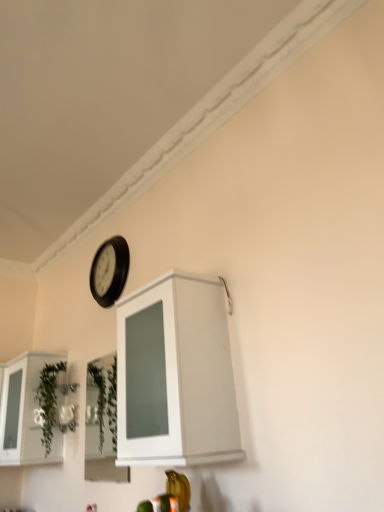
Question: Does black plastic clock at upper center turn towards white glossy cabinet at upper center, which is counted as the 1th cabinetry, starting from the right?

Choices:
 (A) no
 (B) yes

Answer: (A)

Question: Is black plastic clock at upper center surrounding white glossy cabinet at upper center, acting as the first cabinetry starting from the front?

Choices:
 (A) no
 (B) yes

Answer: (A)

Question: Can you confirm if black plastic clock at upper center is positioned to the left of white glossy cabinet at upper center, which is counted as the 1th cabinetry, starting from the right?

Choices:
 (A) no
 (B) yes

Answer: (B)

Question: From a real-world perspective, is black plastic clock at upper center beneath white glossy cabinet at upper center, acting as the first cabinetry starting from the front?

Choices:
 (A) yes
 (B) no

Answer: (B)

Question: From the image's perspective, is black plastic clock at upper center located above white glossy cabinet at upper center, the second cabinetry in the left-to-right sequence?

Choices:
 (A) no
 (B) yes

Answer: (B)

Question: Would you say white glossy cabinet at left, the first cabinetry viewed from the back, is to the left or to the right of white glossy cabinet at upper center, the second cabinetry in the left-to-right sequence, in the picture?

Choices:
 (A) right
 (B) left

Answer: (B)

Question: Is white glossy cabinet at left, which appears as the second cabinetry when viewed from the front, in front of or behind white glossy cabinet at upper center, acting as the first cabinetry starting from the front, in the image?

Choices:
 (A) front
 (B) behind

Answer: (B)

Question: Is white glossy cabinet at left, the 2th cabinetry viewed from the right, wider or thinner than white glossy cabinet at upper center, the second cabinetry in the left-to-right sequence?

Choices:
 (A) wide
 (B) thin

Answer: (A)

Question: In terms of height, does white glossy cabinet at left, the 2th cabinetry viewed from the right, look taller or shorter compared to white glossy cabinet at upper center, which is counted as the 1th cabinetry, starting from the right?

Choices:
 (A) tall
 (B) short

Answer: (B)

Question: From the image's perspective, relative to white glossy cabinet at upper center, the second cabinetry in the left-to-right sequence, is black plastic clock at upper center above or below?

Choices:
 (A) below
 (B) above

Answer: (B)

Question: Does point (119, 240) appear closer or farther from the camera than point (117, 386)?

Choices:
 (A) farther
 (B) closer

Answer: (A)

Question: Relative to white glossy cabinet at upper center, which is counted as the 1th cabinetry, starting from the right, is black plastic clock at upper center in front or behind?

Choices:
 (A) front
 (B) behind

Answer: (B)

Question: Is black plastic clock at upper center spatially inside white glossy cabinet at upper center, which is counted as the 1th cabinetry, starting from the right, or outside of it?

Choices:
 (A) outside
 (B) inside

Answer: (A)

Question: In terms of size, does green leafy plant at lower left appear bigger or smaller than black plastic clock at upper center?

Choices:
 (A) small
 (B) big

Answer: (B)

Question: From the image's perspective, is green leafy plant at lower left above or below black plastic clock at upper center?

Choices:
 (A) below
 (B) above

Answer: (A)